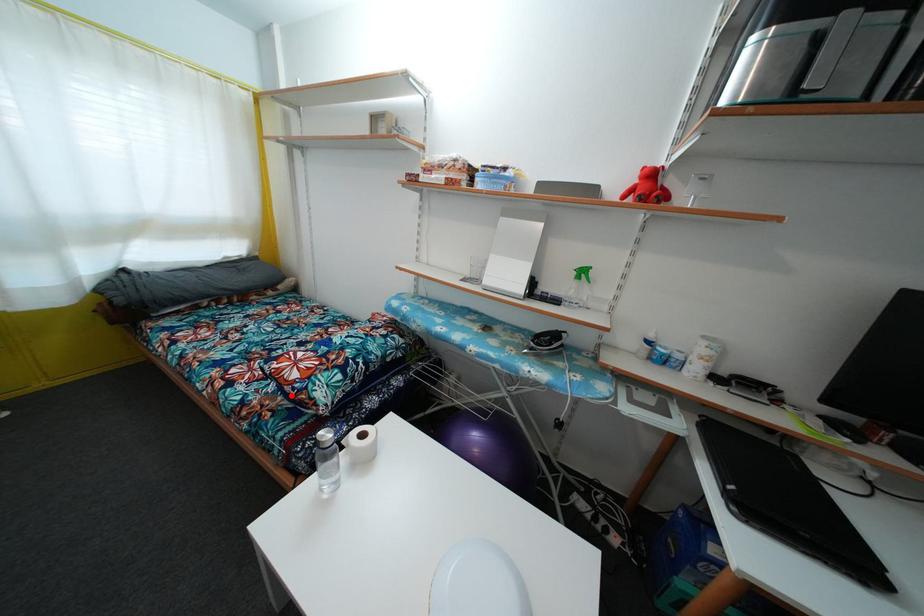
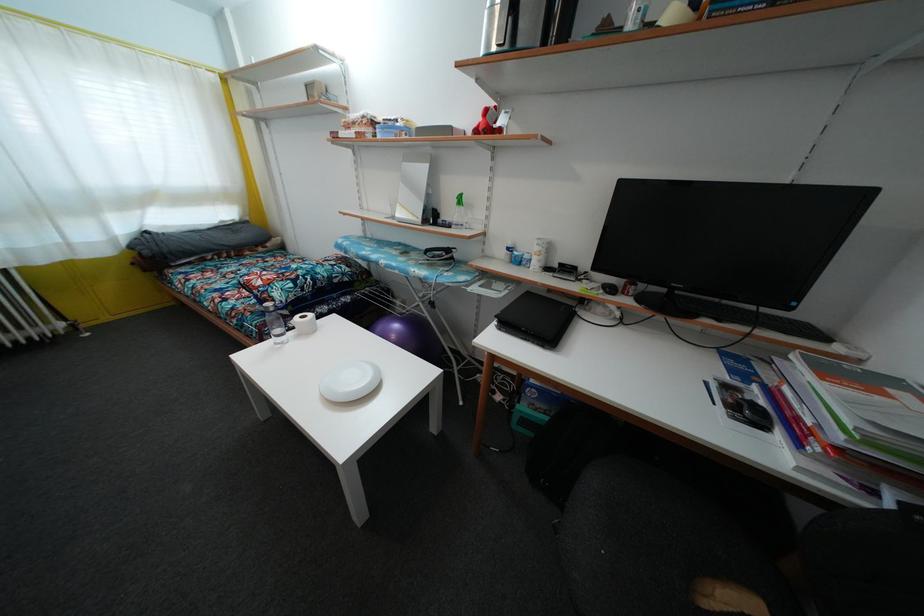
In the second image, find the point that corresponds to the highlighted location in the first image.

(259, 299)